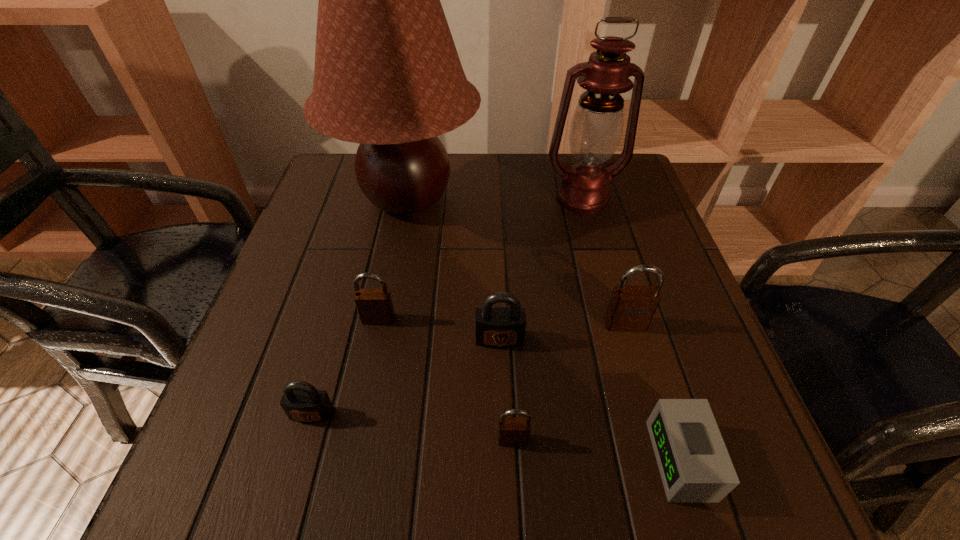
Where is `padlock that is at the right edge`? This screenshot has width=960, height=540. padlock that is at the right edge is located at coordinates (631, 308).

Where is `alarm clock that is at the right edge`? alarm clock that is at the right edge is located at coordinates (695, 467).

Image resolution: width=960 pixels, height=540 pixels. I want to click on object positioned at the far left corner, so click(387, 75).

What are the coordinates of `object at the far right corner` in the screenshot? It's located at (596, 127).

Find the location of a particular element. object that is at the near right corner is located at coordinates (695, 467).

In order to click on vacant space at the far edge in this screenshot , I will do `click(502, 191)`.

Where is `free space at the near edge of the desktop`? Image resolution: width=960 pixels, height=540 pixels. free space at the near edge of the desktop is located at coordinates (538, 492).

Where is `free space at the left edge of the desktop`? free space at the left edge of the desktop is located at coordinates (329, 288).

Where is `free location at the right edge of the desktop`? The width and height of the screenshot is (960, 540). free location at the right edge of the desktop is located at coordinates (708, 356).

I want to click on vacant space at the far left corner of the desktop, so click(x=353, y=182).